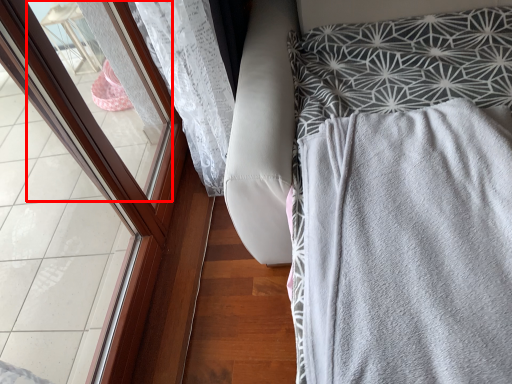
Question: From the image's perspective, where is window (annotated by the red box) located in relation to furniture in the image?

Choices:
 (A) above
 (B) below

Answer: (A)